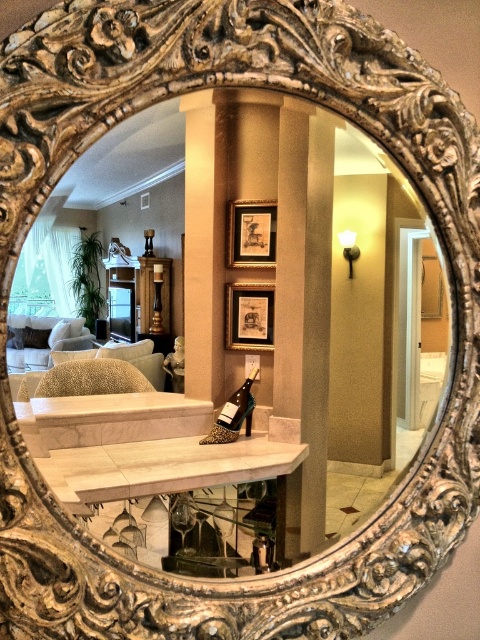
Question: Observing the image, what is the correct spatial positioning of gold ornate mirror at center in reference to matte gold picture frame at center?

Choices:
 (A) left
 (B) right

Answer: (B)

Question: Which is nearer to the beige textured pillar at center?

Choices:
 (A) gold ornate mirror at center
 (B) gold metallic picture frame at center
 (C) matte gold picture frame at center

Answer: (B)

Question: Does gold metallic picture frame at center have a larger size compared to matte gold picture frame at center?

Choices:
 (A) yes
 (B) no

Answer: (B)

Question: Which object is positioned closest to the matte gold picture frame at center?

Choices:
 (A) beige textured pillar at center
 (B) gold metallic picture frame at center

Answer: (B)

Question: Can you confirm if gold metallic picture frame at center is bigger than matte gold picture frame at center?

Choices:
 (A) no
 (B) yes

Answer: (A)

Question: Which object is farther from the camera taking this photo?

Choices:
 (A) gold metallic picture frame at center
 (B) matte gold picture frame at center
 (C) beige textured pillar at center

Answer: (B)